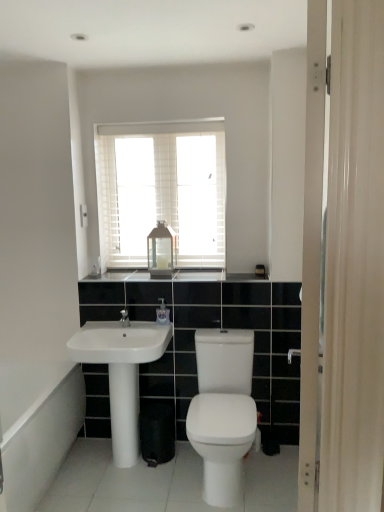
The height and width of the screenshot is (512, 384). In order to click on free space in front of matte glass lantern at center in this screenshot , I will do `click(160, 275)`.